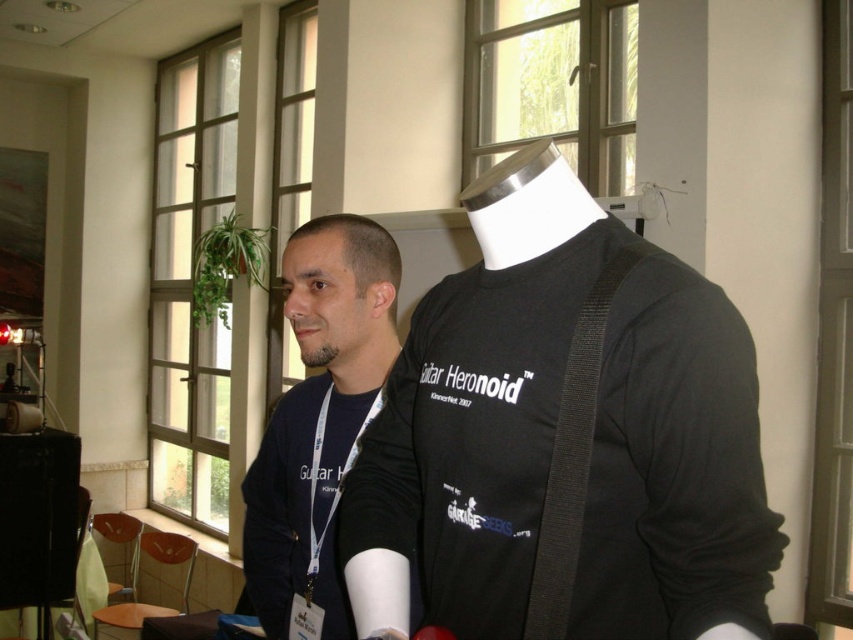
You are organizing a clothing display and need to arrange the black matte shirt at center and the matte black shirt at center. According to the image, which one should be placed to the right of the other?

The black matte shirt at center should be placed to the right of the matte black shirt at center because the black matte shirt at center is positioned on the right side of matte black shirt at center in the image.